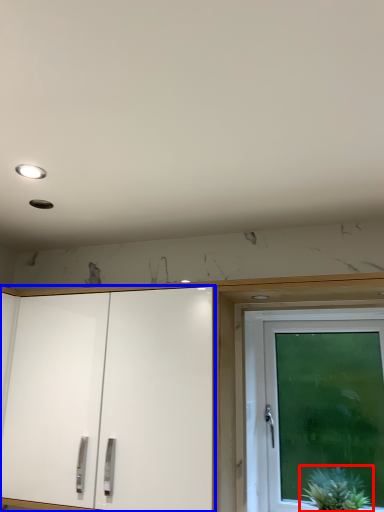
Question: Among these objects, which one is nearest to the camera, houseplant (highlighted by a red box) or cabinetry (highlighted by a blue box)?

Choices:
 (A) houseplant
 (B) cabinetry

Answer: (B)